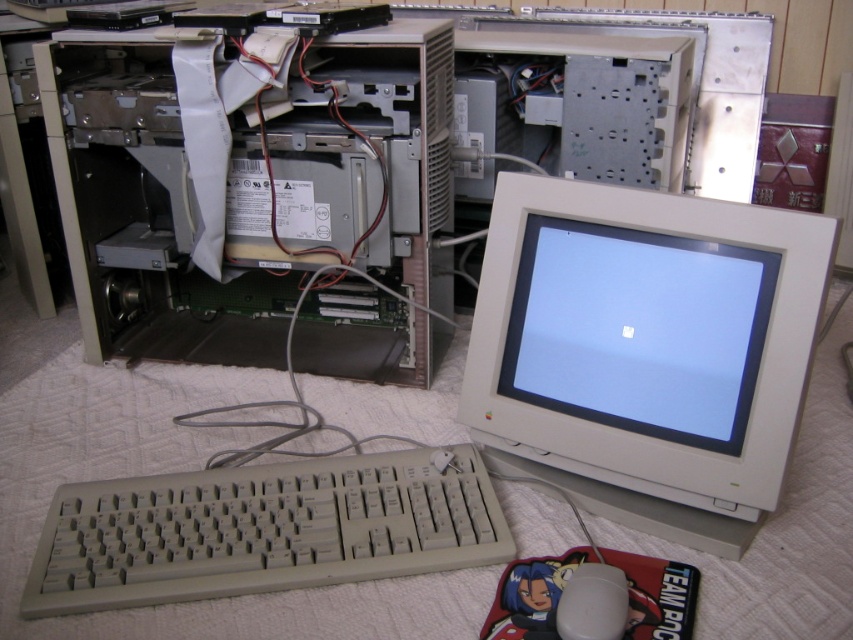
Question: Does silver metallic computer at center have a smaller size compared to beige plastic keyboard at lower left?

Choices:
 (A) yes
 (B) no

Answer: (B)

Question: Is white glossy monitor at center to the right of white matte mouse at lower center from the viewer's perspective?

Choices:
 (A) no
 (B) yes

Answer: (B)

Question: Which of the following is the closest to the observer?

Choices:
 (A) (573, 291)
 (B) (627, 592)
 (C) (91, 134)
 (D) (80, 532)

Answer: (B)

Question: Which point is farther to the camera?

Choices:
 (A) (235, 113)
 (B) (647, 468)

Answer: (A)

Question: Does beige plastic keyboard at lower left come behind white glossy monitor at center?

Choices:
 (A) yes
 (B) no

Answer: (B)

Question: Which point is closer to the camera?

Choices:
 (A) white matte mouse at lower center
 (B) white glossy monitor at center
 (C) silver metallic computer at center
 (D) white plastic monitor at center

Answer: (A)